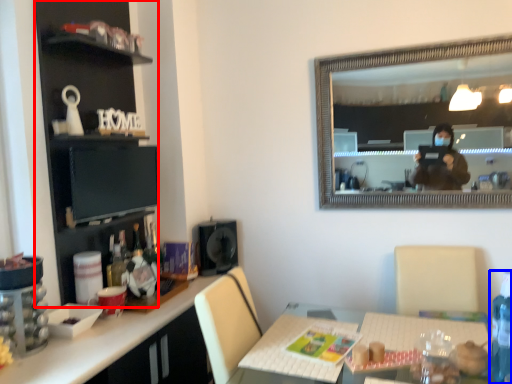
Question: Which point is closer to the camera, cabinetry (highlighted by a red box) or bottle (highlighted by a blue box)?

Choices:
 (A) cabinetry
 (B) bottle

Answer: (B)